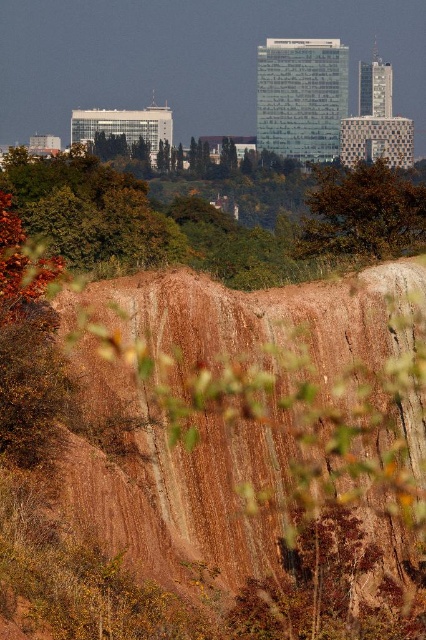
You are an environmental scientist studying the distribution of tree species in this area. You observe the green leafy tree at upper center and the brown leafy tree at center. Which tree is located to the left of the other?

Result: The green leafy tree at upper center is positioned on the left side of brown leafy tree at center.

You are an environmental scientist observing the image. You need to determine the spatial relationship between the green leafy tree at upper center and the brown leafy tree at center. Which tree is closer to the observer?

The green leafy tree at upper center is closer to the observer because the brown leafy tree at center is positioned behind it.

You are standing at the point marked as point (89, 211) in the image. Looking around, you see a green leafy tree at upper center. Can you determine if the green leafy tree at upper center is directly in front of you or to your side?

The green leafy tree at upper center is located at point (89, 211), which matches your current position. This means you are standing directly under or at the base of the green leafy tree at upper center, so it is neither in front nor to the side but directly where you are positioned.